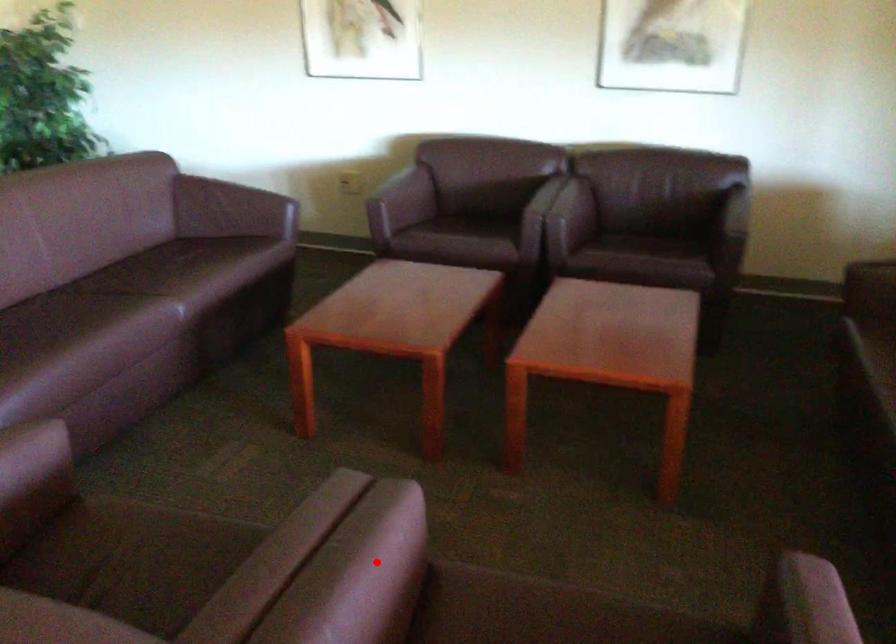
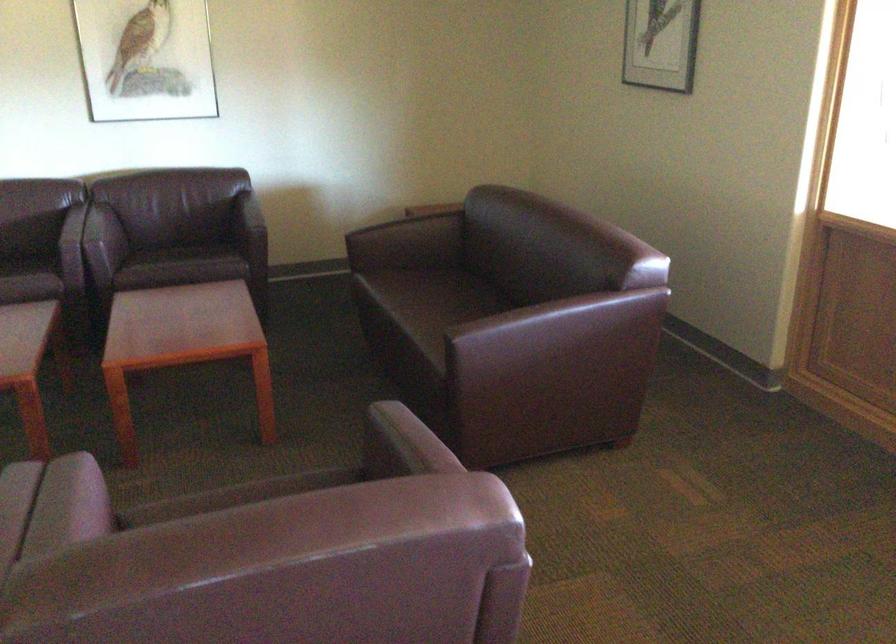
The point at the highlighted location is marked in the first image. Where is the corresponding point in the second image?

(67, 506)